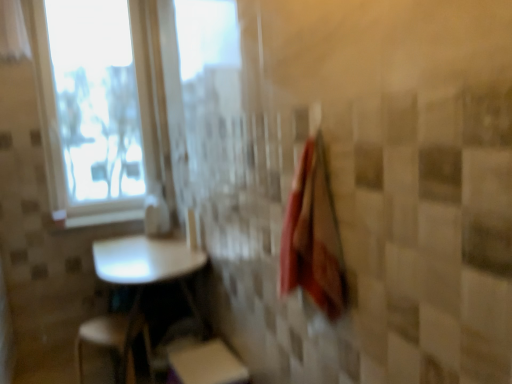
Question: Considering the relative sizes of white glossy window sill at upper left and transparent plastic window screen at upper left in the image provided, is white glossy window sill at upper left bigger than transparent plastic window screen at upper left?

Choices:
 (A) yes
 (B) no

Answer: (B)

Question: From the image's perspective, is white glossy window sill at upper left on transparent plastic window screen at upper left?

Choices:
 (A) no
 (B) yes

Answer: (A)

Question: Is there a large distance between white glossy window sill at upper left and transparent plastic window screen at upper left?

Choices:
 (A) yes
 (B) no

Answer: (B)

Question: Could you tell me if white glossy window sill at upper left is facing transparent plastic window screen at upper left?

Choices:
 (A) no
 (B) yes

Answer: (A)

Question: Is white glossy window sill at upper left taller than transparent plastic window screen at upper left?

Choices:
 (A) no
 (B) yes

Answer: (A)

Question: Does white glossy window sill at upper left touch transparent plastic window screen at upper left?

Choices:
 (A) yes
 (B) no

Answer: (B)

Question: Can you confirm if white sheer curtain at upper left is positioned to the right of white matte step stool at lower center, placed as the 2th step stool when sorted from left to right?

Choices:
 (A) yes
 (B) no

Answer: (B)

Question: Is white sheer curtain at upper left outside of white matte step stool at lower center, placed as the 1th step stool when sorted from right to left?

Choices:
 (A) yes
 (B) no

Answer: (A)

Question: Is white sheer curtain at upper left smaller than white matte step stool at lower center, placed as the 1th step stool when sorted from right to left?

Choices:
 (A) yes
 (B) no

Answer: (A)

Question: Does white sheer curtain at upper left touch white matte step stool at lower center, placed as the 1th step stool when sorted from right to left?

Choices:
 (A) no
 (B) yes

Answer: (A)

Question: From the image's perspective, is white sheer curtain at upper left under white matte step stool at lower center, placed as the 2th step stool when sorted from left to right?

Choices:
 (A) no
 (B) yes

Answer: (A)

Question: Is white sheer curtain at upper left facing towards white matte step stool at lower center, placed as the 2th step stool when sorted from left to right?

Choices:
 (A) no
 (B) yes

Answer: (A)

Question: From a real-world perspective, is white sheer curtain at upper left below white glossy table at lower left?

Choices:
 (A) no
 (B) yes

Answer: (A)